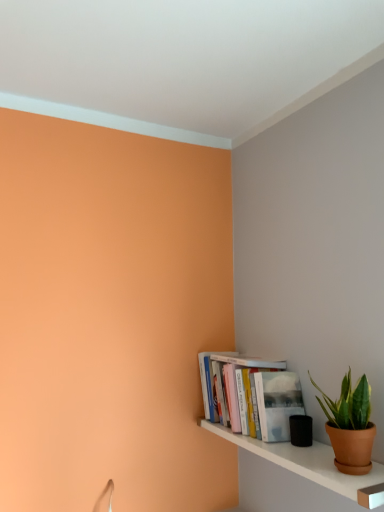
I want to click on hardcover books at lower right, so click(x=255, y=394).

In order to face hardcover books at lower right, should I rotate leftwards or rightwards?

Rotate right and turn 7.029 degrees.

Where is `white glossy shelf at lower right`? white glossy shelf at lower right is located at coordinates (302, 461).

Would you say green matte plant pot at lower right is part of white glossy shelf at lower right's contents?

No, green matte plant pot at lower right is not a part of white glossy shelf at lower right.

Consider the image. From a real-world perspective, who is located higher, white glossy shelf at lower right or green matte plant pot at lower right?

green matte plant pot at lower right is physically above.

Could you tell me if white glossy shelf at lower right is facing green matte plant pot at lower right?

No.

Considering the positions of points (202, 353) and (335, 444), is point (202, 353) farther from camera compared to point (335, 444)?

That is True.

Is point (332, 407) closer or farther from the camera than point (288, 382)?

Point (332, 407).

Can you confirm if green matte plant pot at lower right is taller than hardcover books at lower right?

In fact, green matte plant pot at lower right may be shorter than hardcover books at lower right.

Is green matte plant pot at lower right wider than hardcover books at lower right?

No, green matte plant pot at lower right is not wider than hardcover books at lower right.

Considering the relative sizes of green matte plant pot at lower right and hardcover books at lower right in the image provided, is green matte plant pot at lower right smaller than hardcover books at lower right?

Yes.

I want to click on shelf below the hardcover books at lower right (from the image's perspective), so click(x=302, y=461).

Considering the relative positions of white glossy shelf at lower right and hardcover books at lower right in the image provided, is white glossy shelf at lower right to the right of hardcover books at lower right from the viewer's perspective?

Yes, white glossy shelf at lower right is to the right of hardcover books at lower right.

From the image's perspective, is white glossy shelf at lower right positioned above or below hardcover books at lower right?

white glossy shelf at lower right is situated lower than hardcover books at lower right in the image.

Are hardcover books at lower right and white glossy shelf at lower right located far from each other?

That's not correct — hardcover books at lower right is a little close to white glossy shelf at lower right.

You are a GUI agent. You are given a task and a screenshot of the screen. Output one action in this format:
    pyautogui.click(x=<x>, y=<y>)
    Task: Click on the book above the white glossy shelf at lower right (from a real-world perspective)
    The height and width of the screenshot is (512, 384).
    Given the screenshot: What is the action you would take?
    pyautogui.click(x=255, y=394)

Which is closer to the camera, (247,412) or (348,482)?

The point (348,482) is closer.

Which of these two, hardcover books at lower right or white glossy shelf at lower right, stands taller?

hardcover books at lower right is taller.

Is the depth of green matte plant pot at lower right less than that of white glossy shelf at lower right?

No, green matte plant pot at lower right is behind white glossy shelf at lower right.

From the image's perspective, is green matte plant pot at lower right located above white glossy shelf at lower right?

Yes, from the image's perspective, green matte plant pot at lower right is on top of white glossy shelf at lower right.

Is white glossy shelf at lower right located within green matte plant pot at lower right?

No, white glossy shelf at lower right is not inside green matte plant pot at lower right.

Is the surface of hardcover books at lower right in direct contact with green matte plant pot at lower right?

No, hardcover books at lower right is not making contact with green matte plant pot at lower right.

Is the depth of hardcover books at lower right less than that of green matte plant pot at lower right?

That is False.

Do you think hardcover books at lower right is within green matte plant pot at lower right, or outside of it?

hardcover books at lower right exists outside the volume of green matte plant pot at lower right.

From the image's perspective, is hardcover books at lower right above or below green matte plant pot at lower right?

From the image's perspective, hardcover books at lower right appears below green matte plant pot at lower right.

Identify the location of shelf in front of the green matte plant pot at lower right. This screenshot has width=384, height=512. (302, 461).

This screenshot has width=384, height=512. I want to click on book lying below the green matte plant pot at lower right (from the image's perspective), so click(255, 394).

Looking at the image, which one is located closer to green matte plant pot at lower right, white glossy shelf at lower right or hardcover books at lower right?

Result: white glossy shelf at lower right.

Looking at the image, which one is located closer to white glossy shelf at lower right, hardcover books at lower right or green matte plant pot at lower right?

hardcover books at lower right is closer to white glossy shelf at lower right.

Based on their spatial positions, is green matte plant pot at lower right or white glossy shelf at lower right closer to hardcover books at lower right?

white glossy shelf at lower right is closer to hardcover books at lower right.

Estimate the real-world distances between objects in this image. Which object is closer to green matte plant pot at lower right, hardcover books at lower right or white glossy shelf at lower right?

white glossy shelf at lower right is positioned closer to the anchor green matte plant pot at lower right.

Estimate the real-world distances between objects in this image. Which object is further from white glossy shelf at lower right, green matte plant pot at lower right or hardcover books at lower right?

green matte plant pot at lower right is positioned further to the anchor white glossy shelf at lower right.

Looking at the image, which one is located closer to hardcover books at lower right, white glossy shelf at lower right or green matte plant pot at lower right?

The object closer to hardcover books at lower right is white glossy shelf at lower right.

Find the location of a particular element. Image resolution: width=384 pixels, height=512 pixels. houseplant between white glossy shelf at lower right and hardcover books at lower right along the z-axis is located at coordinates (350, 425).